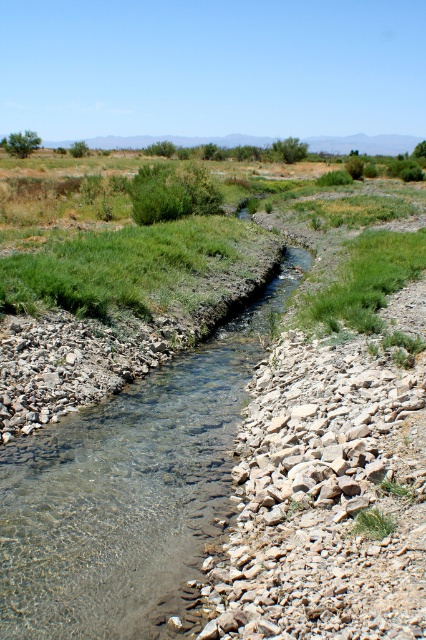
Question: Is clear water stream at center positioned before green leafy bush at upper left?

Choices:
 (A) yes
 (B) no

Answer: (A)

Question: Is the position of clear water stream at center more distant than that of green leafy bush at upper left?

Choices:
 (A) yes
 (B) no

Answer: (B)

Question: Which point is farther to the camera?

Choices:
 (A) (14, 451)
 (B) (2, 141)

Answer: (B)

Question: Does clear water stream at center have a greater width compared to green leafy bush at upper left?

Choices:
 (A) yes
 (B) no

Answer: (B)

Question: Among these objects, which one is nearest to the camera?

Choices:
 (A) clear water stream at center
 (B) green leafy bush at upper left

Answer: (A)